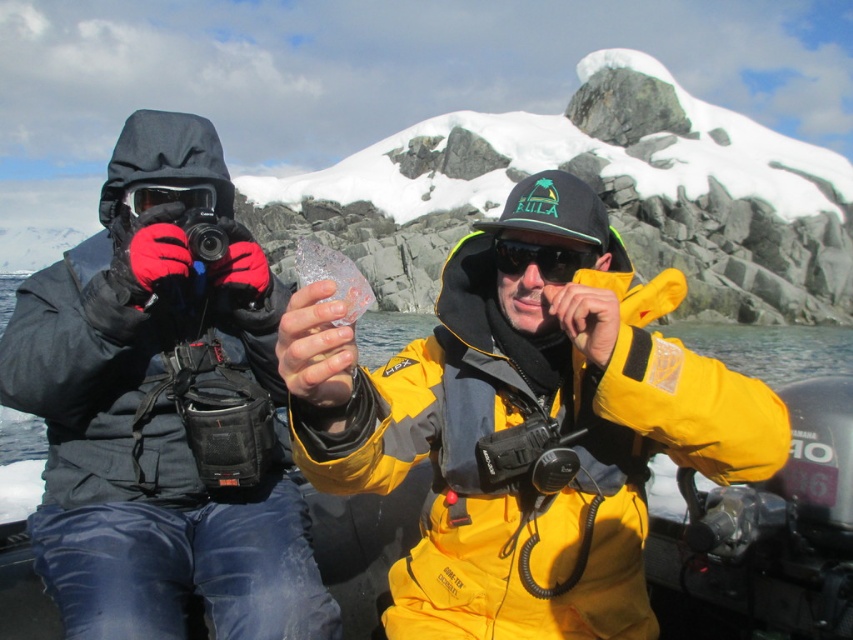
You are an explorer in Antarctica and need to locate your equipment. You have a matte black jacket at left and matte black goggles at left. According to the scene, which item is positioned further to the left?

The matte black jacket at left is positioned further to the left than the matte black goggles at left.

Based on the photo, you are a drone operator trying to capture a photo of both the matte black jacket at left and the bright yellow jacket on the right. The camera has a maximum range of 20 feet. Can you get both in the frame?

The distance between the matte black jacket at left and the bright yellow jacket on the right is 23.61 feet. Since the camera can only capture up to 20 feet, it won

You are a researcher in Antarctica and need to locate your sunglasses. You see the matte black jacket at left and the black matte sunglasses at center. Which object is closer to you?

The matte black jacket at left is closer to you because it is in front of the black matte sunglasses at center.